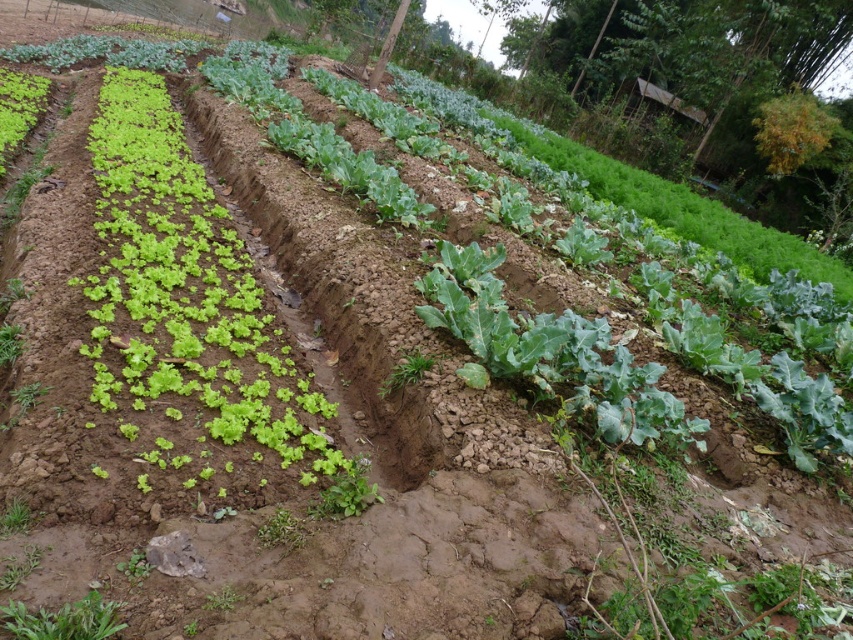
Looking at this image, you are a farmer checking the spacing between plants in your field. You have two green leafy plants to plant. The recommended spacing between plants is 20 inches. You have a green leafy at lower left and a green leafy at center. Do you need to adjust the spacing between them?

The green leafy at lower left is 19.99 inches from green leafy at center. Since the recommended spacing is 20 inches, the current distance is just 0.01 inches less than required. This minimal difference likely doesn

What are the 2D coordinates of the green leafy lettuce at left in the image?

The 2D coordinates of the green leafy lettuce at left are at point [196,291].